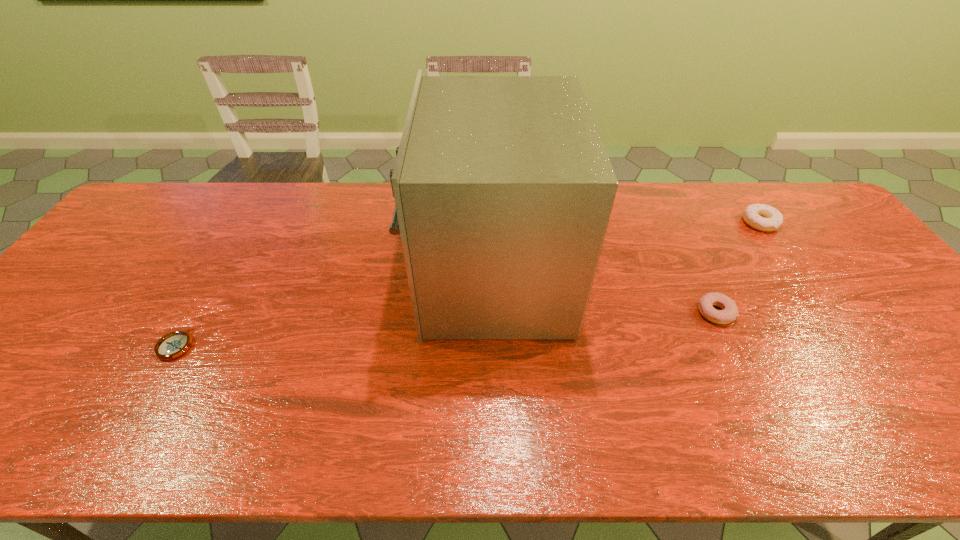
Where is `the third object from right to left`? This screenshot has width=960, height=540. the third object from right to left is located at coordinates (503, 188).

Image resolution: width=960 pixels, height=540 pixels. What are the coordinates of `toaster oven` in the screenshot? It's located at (503, 188).

Where is `the taller doughnut`? This screenshot has width=960, height=540. the taller doughnut is located at coordinates (761, 217).

Where is `the rightmost object`? the rightmost object is located at coordinates (761, 217).

This screenshot has width=960, height=540. Find the location of `the shorter doughnut`. the shorter doughnut is located at coordinates (729, 313).

Where is `the left doughnut`? The height and width of the screenshot is (540, 960). the left doughnut is located at coordinates (729, 313).

At what (x,y) coordinates should I click in order to perform the action: click on the leftmost object. Please return your answer as a coordinate pair (x, y). This screenshot has height=540, width=960. Looking at the image, I should click on (174, 344).

Where is `the shortest object`? This screenshot has width=960, height=540. the shortest object is located at coordinates (174, 344).

This screenshot has width=960, height=540. Find the location of `vacant area situated on the front panel of the toaster oven`. vacant area situated on the front panel of the toaster oven is located at coordinates (326, 275).

You are a GUI agent. You are given a task and a screenshot of the screen. Output one action in this format:
    pyautogui.click(x=<x>, y=<y>)
    Task: Click on the vacant space located 0.110m on the front panel of the toaster oven
    Image resolution: width=960 pixels, height=540 pixels.
    Given the screenshot: What is the action you would take?
    point(377,275)